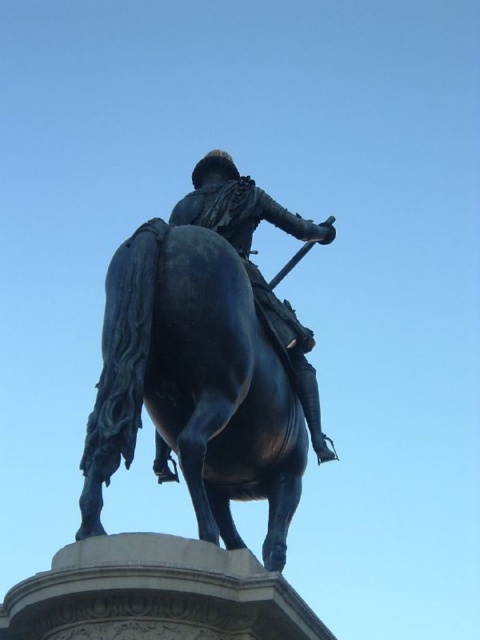
Question: Does shiny black horse at center appear over polished bronze statue at center?

Choices:
 (A) yes
 (B) no

Answer: (B)

Question: Is shiny black horse at center to the left of polished bronze statue at center from the viewer's perspective?

Choices:
 (A) no
 (B) yes

Answer: (B)

Question: Is shiny black horse at center to the right of polished bronze statue at center from the viewer's perspective?

Choices:
 (A) yes
 (B) no

Answer: (B)